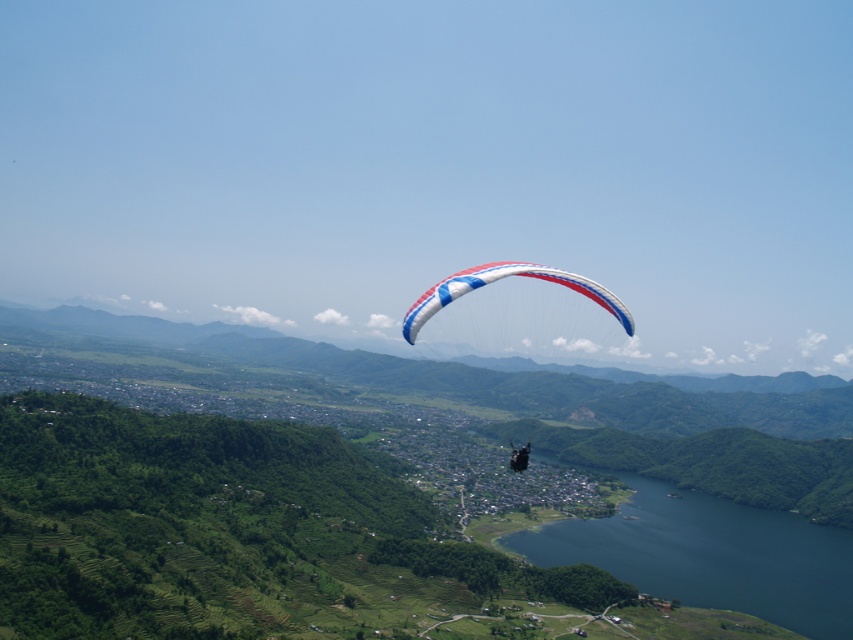
Who is positioned more to the right, white fabric parachute at center or white and blue fabric parachute at center?

From the viewer's perspective, white fabric parachute at center appears more on the right side.

Is white fabric parachute at center to the right of white and blue fabric parachute at center from the viewer's perspective?

Correct, you'll find white fabric parachute at center to the right of white and blue fabric parachute at center.

The height and width of the screenshot is (640, 853). What do you see at coordinates (498, 278) in the screenshot?
I see `white fabric parachute at center` at bounding box center [498, 278].

Where is `white fabric parachute at center`? The image size is (853, 640). white fabric parachute at center is located at coordinates (498, 278).

Which is more to the left, blue glossy water at lower center or white and blue fabric parachute at center?

white and blue fabric parachute at center

Is blue glossy water at lower center below white and blue fabric parachute at center?

Yes.

Is point (788, 531) more distant than point (560, 269)?

Yes, point (788, 531) is behind point (560, 269).

This screenshot has height=640, width=853. Identify the location of blue glossy water at lower center. (711, 556).

Does blue glossy water at lower center appear under white fabric parachute at center?

Yes.

Does blue glossy water at lower center have a lesser height compared to white fabric parachute at center?

Yes, blue glossy water at lower center is shorter than white fabric parachute at center.

This screenshot has width=853, height=640. What do you see at coordinates (711, 556) in the screenshot? I see `blue glossy water at lower center` at bounding box center [711, 556].

At what (x,y) coordinates should I click in order to perform the action: click on blue glossy water at lower center. Please return your answer as a coordinate pair (x, y). Looking at the image, I should click on (711, 556).